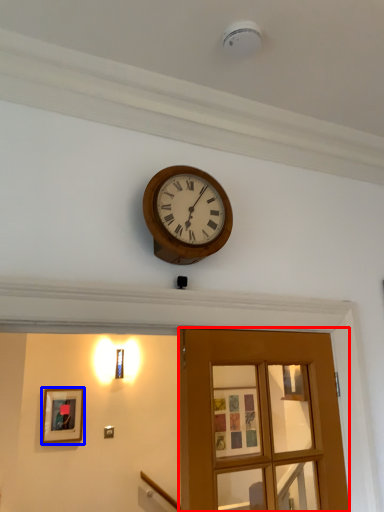
Question: Which of the following is the closest to the observer, door (highlighted by a red box) or picture frame (highlighted by a blue box)?

Choices:
 (A) door
 (B) picture frame

Answer: (A)